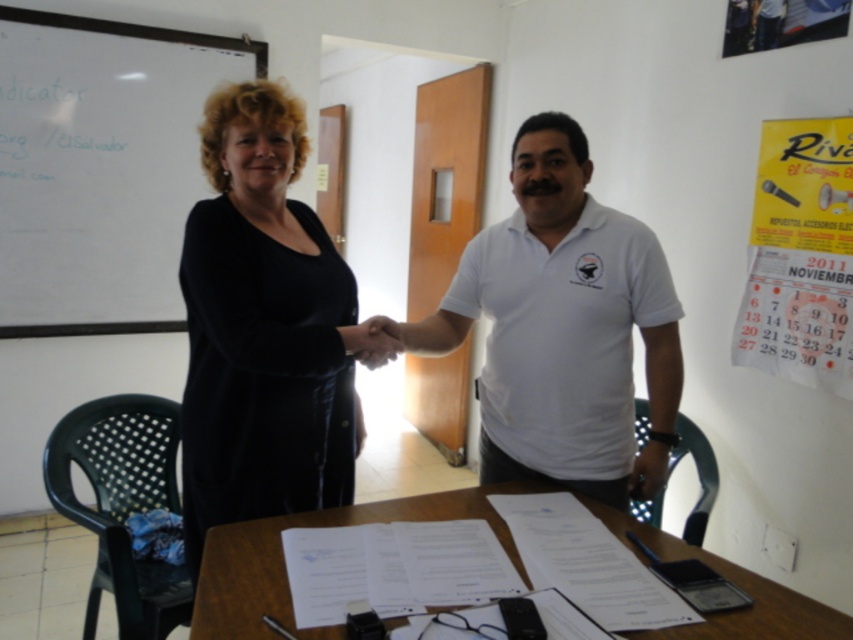
Can you confirm if white cotton shirt at center is positioned above white paper at center?

Correct, white cotton shirt at center is located above white paper at center.

What are the coordinates of `white cotton shirt at center` in the screenshot? It's located at (561, 328).

Image resolution: width=853 pixels, height=640 pixels. Identify the location of white cotton shirt at center. (561, 328).

Looking at this image, can you confirm if black matte dress at center is positioned to the left of yellow paper calendar at upper right?

Correct, you'll find black matte dress at center to the left of yellow paper calendar at upper right.

Does point (282, 314) come behind point (836, 179)?

No, (282, 314) is in front of (836, 179).

You are a GUI agent. You are given a task and a screenshot of the screen. Output one action in this format:
    pyautogui.click(x=<x>, y=<y>)
    Task: Click on the black matte dress at center
    Image resolution: width=853 pixels, height=640 pixels.
    Given the screenshot: What is the action you would take?
    pyautogui.click(x=264, y=328)

Where is `black matte dress at center`? This screenshot has width=853, height=640. black matte dress at center is located at coordinates (264, 328).

Can you confirm if white cotton shirt at center is wider than whiteboard at upper left?

No.

I want to click on white cotton shirt at center, so click(561, 328).

Identify the location of white cotton shirt at center. (561, 328).